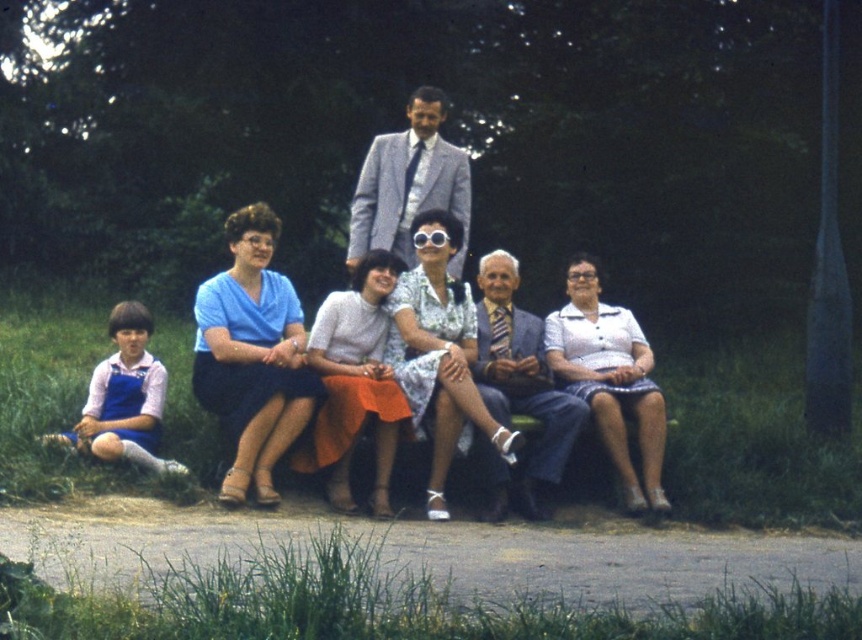
You are a photographer trying to capture a closeup of both the matte blue dress at center and the white textured blouse at center in the scene. Given that your camera lens can only focus on objects within a 15 inch range, will you be able to capture both in focus without adjusting the focus distance?

The matte blue dress at center and white textured blouse at center are 18.19 inches apart from each other. Since the distance between them exceeds the 15 inch range of the camera lens, you will need to adjust the focus distance to ensure both are in focus.

You are a photographer who needs to adjust the focus on your camera. You want to capture both the matte blue dress at center and the blue fabric dress at center clearly. Which dress should you focus on first to ensure both are in focus?

You should focus on the matte blue dress at center first because the blue fabric dress at center is behind it, so adjusting focus starting from the front object will help capture both in focus.

From the picture: You are standing in the park scene and want to take a photo of the two points mentioned. Which point, point (456, 426) or point (264, 228), will appear larger in your camera view because it is closer?

Point (456, 426) is closer to the camera than point (264, 228), so it will appear larger in the camera view.